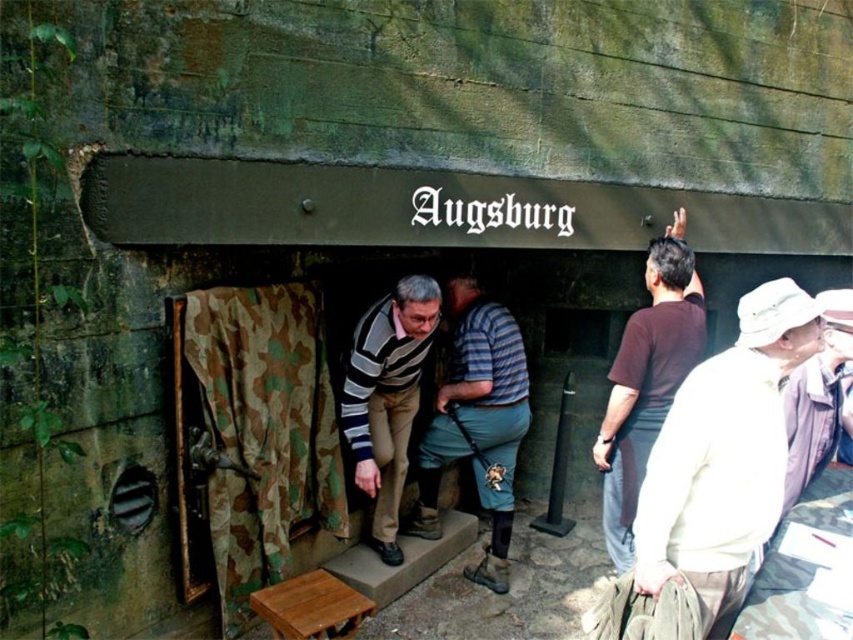
Between white cotton hat at upper right and wooden stool at lower center, which one has more height?

Standing taller between the two is white cotton hat at upper right.

Does white cotton hat at upper right appear under wooden stool at lower center?

No, white cotton hat at upper right is not below wooden stool at lower center.

Where is `white cotton hat at upper right`? Image resolution: width=853 pixels, height=640 pixels. white cotton hat at upper right is located at coordinates (724, 456).

You are a GUI agent. You are given a task and a screenshot of the screen. Output one action in this format:
    pyautogui.click(x=<x>, y=<y>)
    Task: Click on the white cotton hat at upper right
    
    Given the screenshot: What is the action you would take?
    pyautogui.click(x=724, y=456)

Does point (506, 385) come farther from viewer compared to point (614, 516)?

That is True.

Who is positioned more to the right, striped cotton shirt at center or brown cotton shirt at upper right?

From the viewer's perspective, brown cotton shirt at upper right appears more on the right side.

The height and width of the screenshot is (640, 853). I want to click on striped cotton shirt at center, so click(476, 422).

Does point (495, 333) come closer to viewer compared to point (296, 602)?

No, (495, 333) is behind (296, 602).

Can you confirm if striped cotton shirt at center is taller than wooden stool at lower center?

Correct, striped cotton shirt at center is much taller as wooden stool at lower center.

Describe the element at coordinates (476, 422) in the screenshot. The width and height of the screenshot is (853, 640). I see `striped cotton shirt at center` at that location.

Where is `striped cotton shirt at center`? This screenshot has height=640, width=853. striped cotton shirt at center is located at coordinates (476, 422).